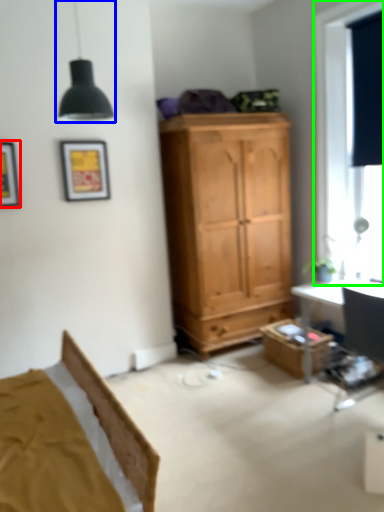
Question: Based on their relative distances, which object is nearer to picture frame (highlighted by a red box)? Choose from light fixture (highlighted by a blue box) and window (highlighted by a green box).

Choices:
 (A) light fixture
 (B) window

Answer: (A)